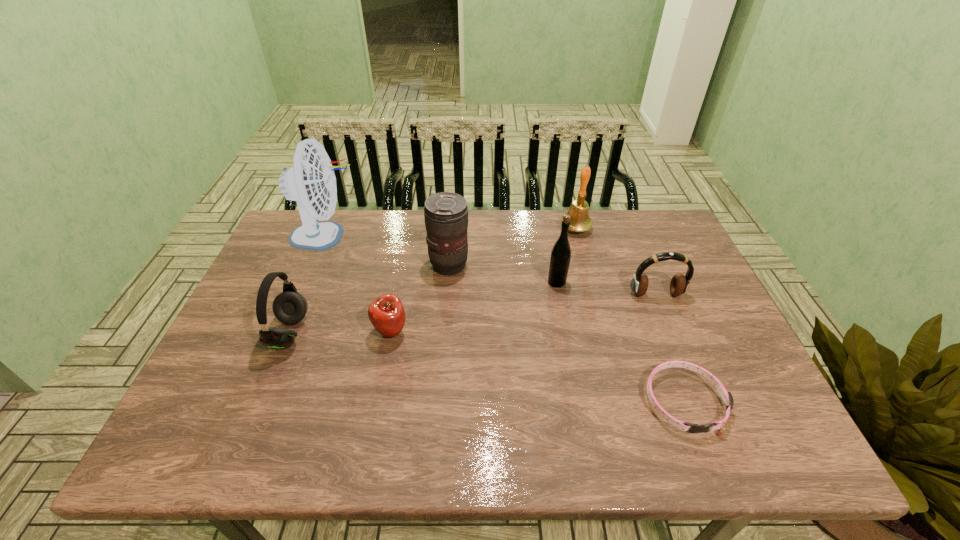
At what (x,y) coordinates should I click in order to perform the action: click on free location at the near edge of the desktop. Please return your answer as a coordinate pair (x, y). Image resolution: width=960 pixels, height=540 pixels. Looking at the image, I should click on (550, 426).

This screenshot has height=540, width=960. In order to click on free location at the left edge of the desktop in this screenshot , I will do `click(238, 408)`.

Locate an element on the screen. This screenshot has height=540, width=960. vacant space at the right edge of the desktop is located at coordinates (691, 291).

Find the location of a particular element. This screenshot has width=960, height=540. free space at the far left corner of the desktop is located at coordinates (335, 218).

In the image, there is a desktop. Where is `vacant space at the far right corner`? The image size is (960, 540). vacant space at the far right corner is located at coordinates (646, 224).

The width and height of the screenshot is (960, 540). Find the location of `blank region between the sixth object from left to right and the nearer headset`. blank region between the sixth object from left to right and the nearer headset is located at coordinates (433, 281).

Image resolution: width=960 pixels, height=540 pixels. Identify the location of free space between the third object from right to left and the telephoto lens. (513, 247).

Find the location of a particular element. free space between the dog collar and the fifth object from left to right is located at coordinates (620, 342).

Find the location of a particular element. Image resolution: width=960 pixels, height=540 pixels. free point between the fan and the nearer headset is located at coordinates (308, 285).

Where is `vacant area that lies between the left headset and the dog collar`? vacant area that lies between the left headset and the dog collar is located at coordinates (487, 367).